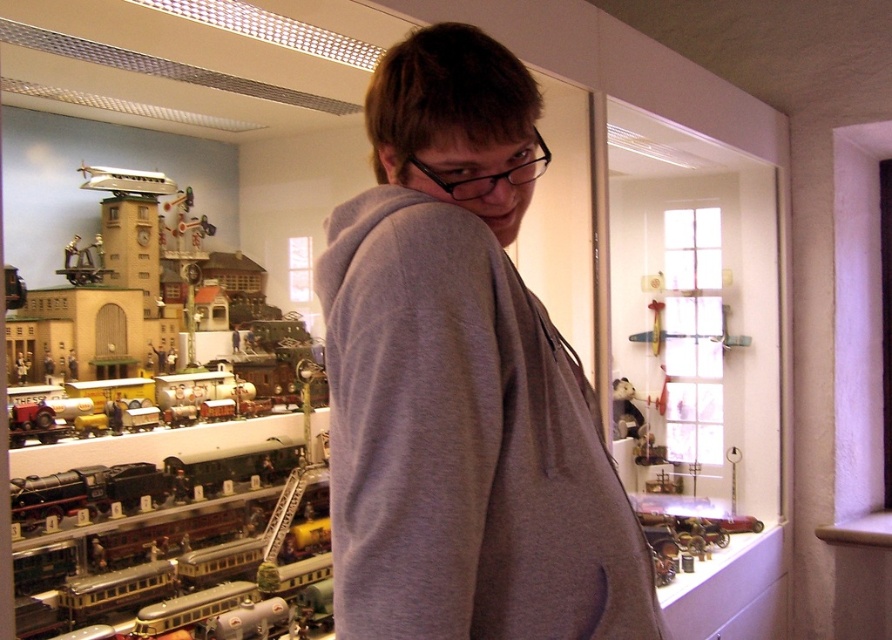
From the picture: Who is lower down, gray cotton hoodie at center or matte green train at left?

matte green train at left is below.

Who is higher up, gray cotton hoodie at center or matte green train at left?

gray cotton hoodie at center is higher up.

Where is `gray cotton hoodie at center`? This screenshot has width=892, height=640. gray cotton hoodie at center is located at coordinates (463, 380).

At what (x,y) coordinates should I click in order to perform the action: click on gray cotton hoodie at center. Please return your answer as a coordinate pair (x, y). The width and height of the screenshot is (892, 640). Looking at the image, I should click on (463, 380).